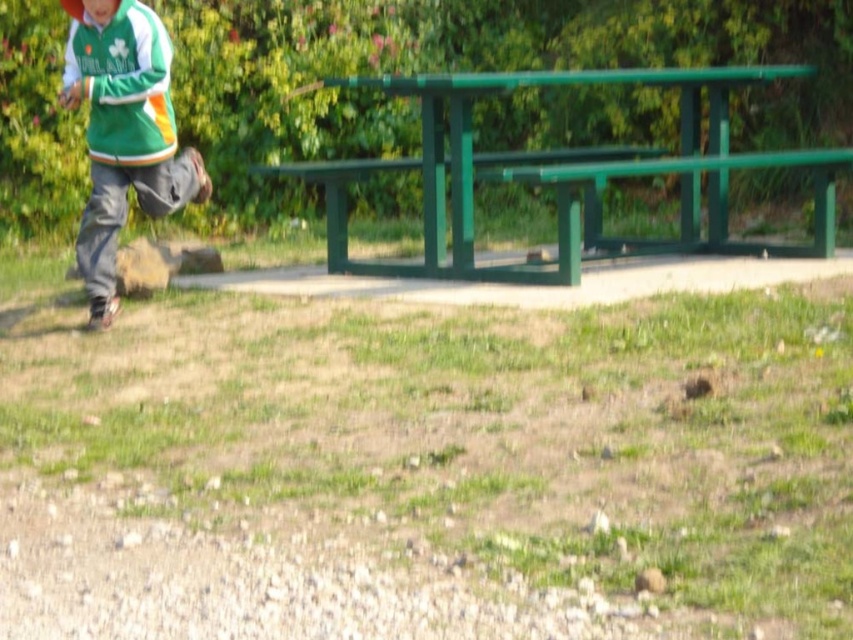
In order to click on green painted wood bench at center in this screenshot , I will do `click(567, 173)`.

Between green painted wood bench at center and green matte baseball cap at upper left, which one has more height?

Standing taller between the two is green painted wood bench at center.

Who is more distant from viewer, (x=625, y=172) or (x=73, y=8)?

Point (x=73, y=8)

Find the location of a particular element. Image resolution: width=853 pixels, height=640 pixels. green painted wood bench at center is located at coordinates (567, 173).

Is point (154, 84) positioned before point (73, 6)?

Yes, point (154, 84) is in front of point (73, 6).

Can you confirm if green fleece jacket at left is smaller than green matte baseball cap at upper left?

No.

Between point (140, 147) and point (79, 3), which one is positioned in front?

Point (140, 147) is in front.

Where is `green fleece jacket at left`? The height and width of the screenshot is (640, 853). green fleece jacket at left is located at coordinates (125, 134).

Is green painted wood bench at center shorter than green fleece jacket at left?

Yes.

Is the position of green painted wood bench at center less distant than that of green fleece jacket at left?

Yes, it is.

Does point (820, 240) lie in front of point (107, 58)?

That is False.

Identify the location of green painted wood bench at center. Image resolution: width=853 pixels, height=640 pixels. (567, 173).